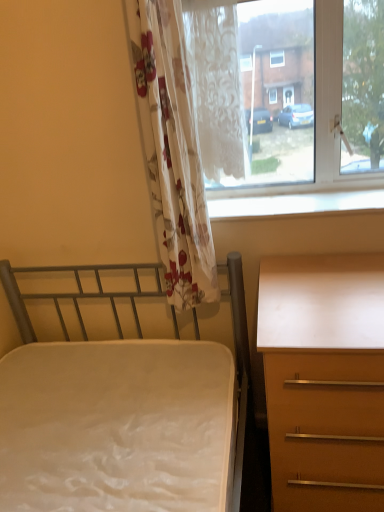
At what (x,y) coordinates should I click in order to perform the action: click on free spot above white glossy window sill at upper center (from a real-world perspective). Please return your answer as a coordinate pair (x, y). Looking at the image, I should click on (291, 201).